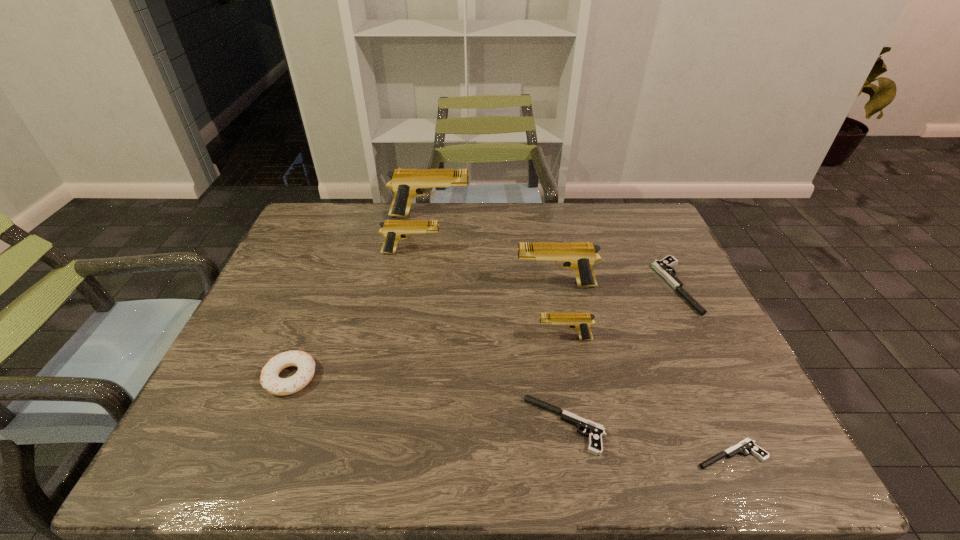
Identify the location of the sixth tallest object. (663, 267).

This screenshot has width=960, height=540. What are the coordinates of `the biggest black pistol` in the screenshot? It's located at (663, 267).

This screenshot has width=960, height=540. What are the coordinates of `the second biggest black pistol` in the screenshot? It's located at (596, 431).

At what (x,y) coordinates should I click in order to perform the action: click on the sixth tallest pistol. Please return your answer as a coordinate pair (x, y). Image resolution: width=960 pixels, height=540 pixels. Looking at the image, I should click on (596, 431).

Where is `the smallest black pistol`? This screenshot has width=960, height=540. the smallest black pistol is located at coordinates (747, 444).

The image size is (960, 540). In order to click on the shortest pistol in this screenshot , I will do `click(747, 444)`.

Where is `free region located 0.140m at the barrel of the farthest pistol`? The width and height of the screenshot is (960, 540). free region located 0.140m at the barrel of the farthest pistol is located at coordinates (512, 216).

Locate an element on the screen. This screenshot has width=960, height=540. vacant area situated at the barrel of the second tallest pistol is located at coordinates (421, 285).

The width and height of the screenshot is (960, 540). What are the coordinates of `free space located at the barrel of the second tallest pistol` in the screenshot? It's located at (389, 285).

Locate an element on the screen. free space located at the barrel of the second tallest pistol is located at coordinates (439, 285).